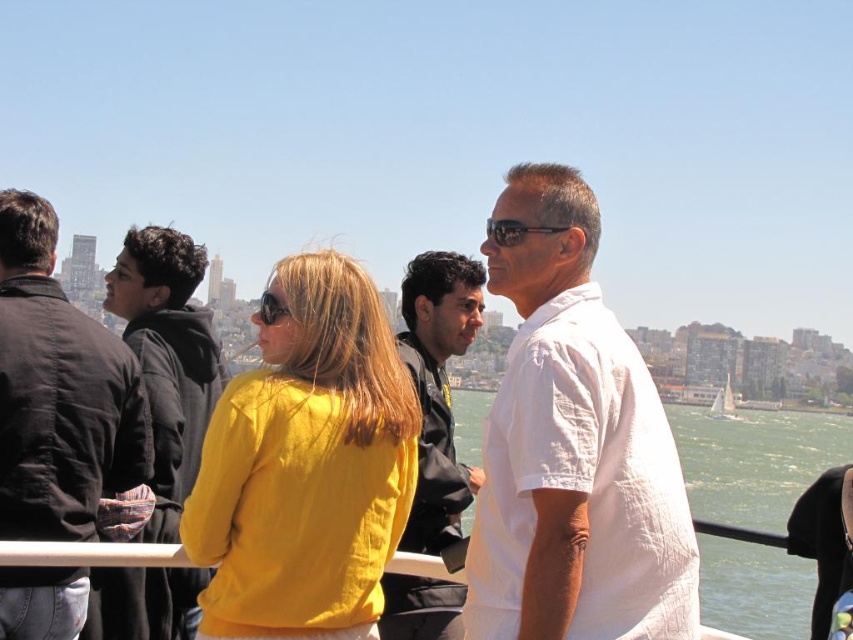
Question: Which of the following is the closest to the observer?

Choices:
 (A) (438, 300)
 (B) (225, 531)
 (C) (3, 534)
 (D) (570, 612)

Answer: (C)

Question: Does yellow fabric jacket at center come in front of dark brown hoodie at left?

Choices:
 (A) yes
 (B) no

Answer: (B)

Question: Can you confirm if clear water at right is positioned above white sailboat at right?

Choices:
 (A) no
 (B) yes

Answer: (A)

Question: Where is dark brown leather jacket at left located in relation to dark brown hoodie at left in the image?

Choices:
 (A) above
 (B) below

Answer: (A)

Question: Which object is positioned closest to the dark brown leather jacket at left?

Choices:
 (A) black leather jacket at center
 (B) clear water at right

Answer: (A)

Question: Among these objects, which one is nearest to the camera?

Choices:
 (A) clear water at right
 (B) dark brown hoodie at left
 (C) black leather jacket at center

Answer: (B)